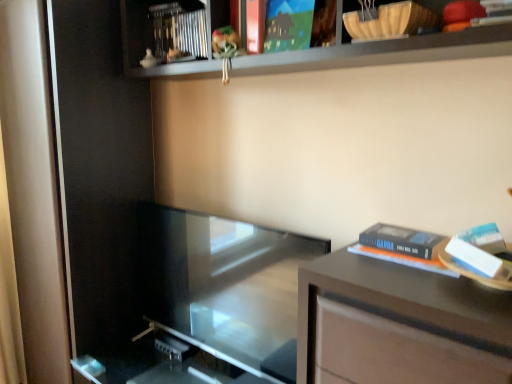
Image resolution: width=512 pixels, height=384 pixels. In order to click on vacant space in front of hardcover book at right, the 1th paperback book viewed from the right in this screenshot , I will do `click(430, 289)`.